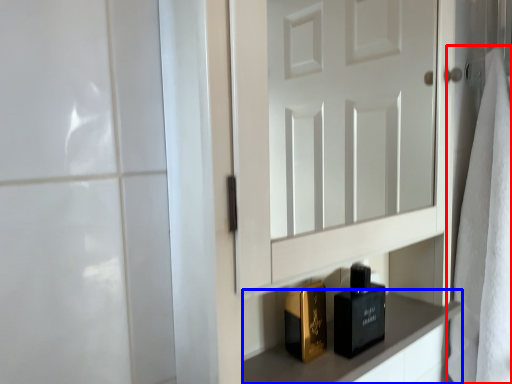
Question: Among these objects, which one is farthest to the camera, bath towel (highlighted by a red box) or cabinetry (highlighted by a blue box)?

Choices:
 (A) bath towel
 (B) cabinetry

Answer: (A)